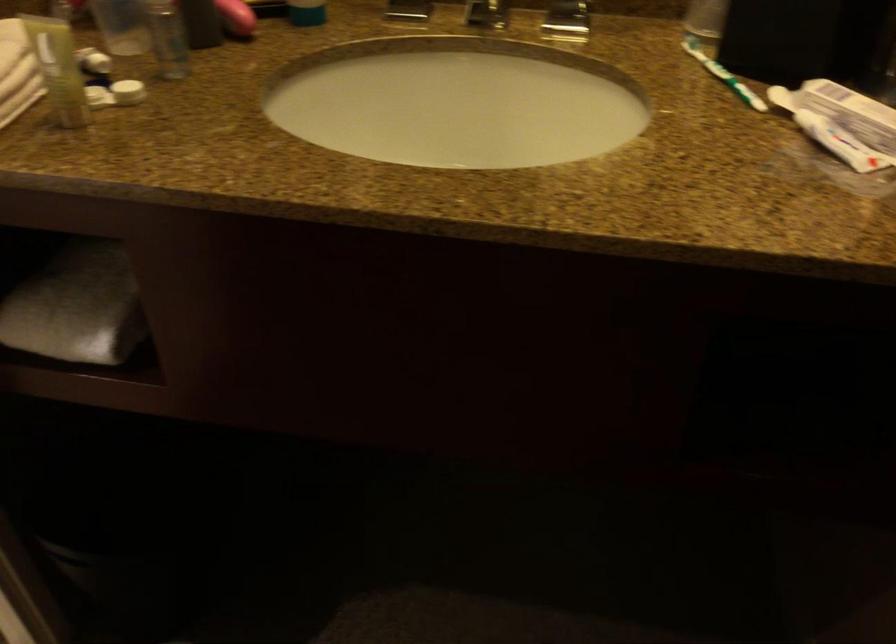
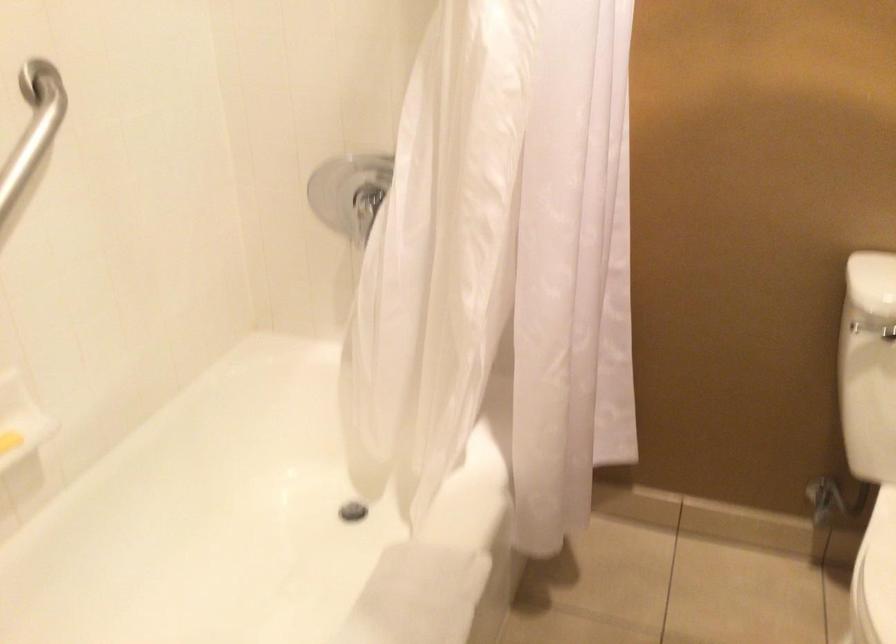
Based on the continuous images, in which direction is the camera rotating?

The camera rotated toward left-down.